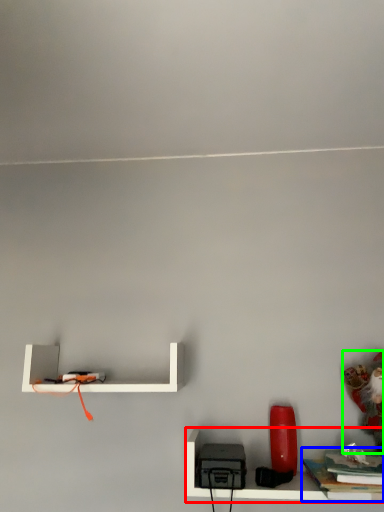
Question: Estimate the real-world distances between objects in this image. Which object is closer to shelf (highlighted by a red box), book (highlighted by a blue box) or toy (highlighted by a green box)?

Choices:
 (A) book
 (B) toy

Answer: (A)